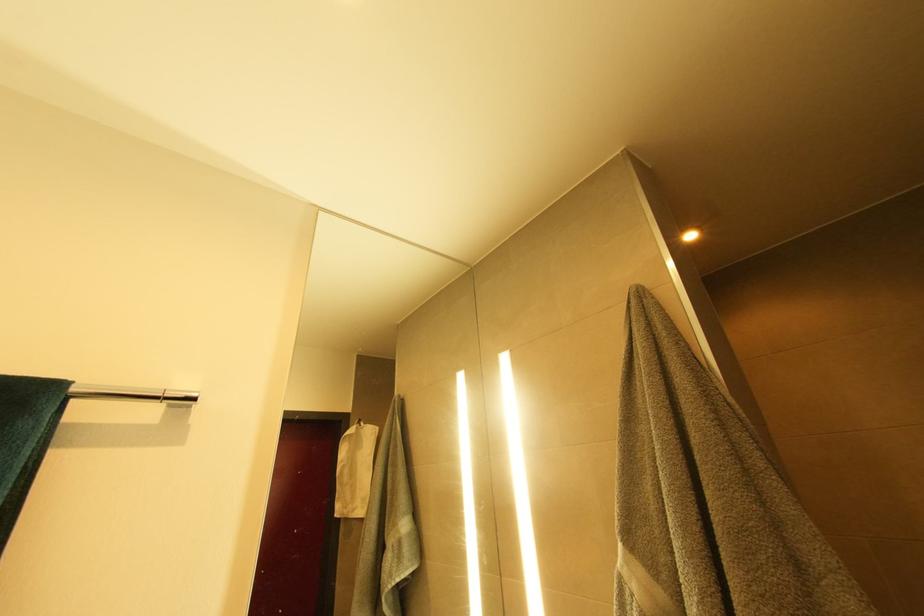
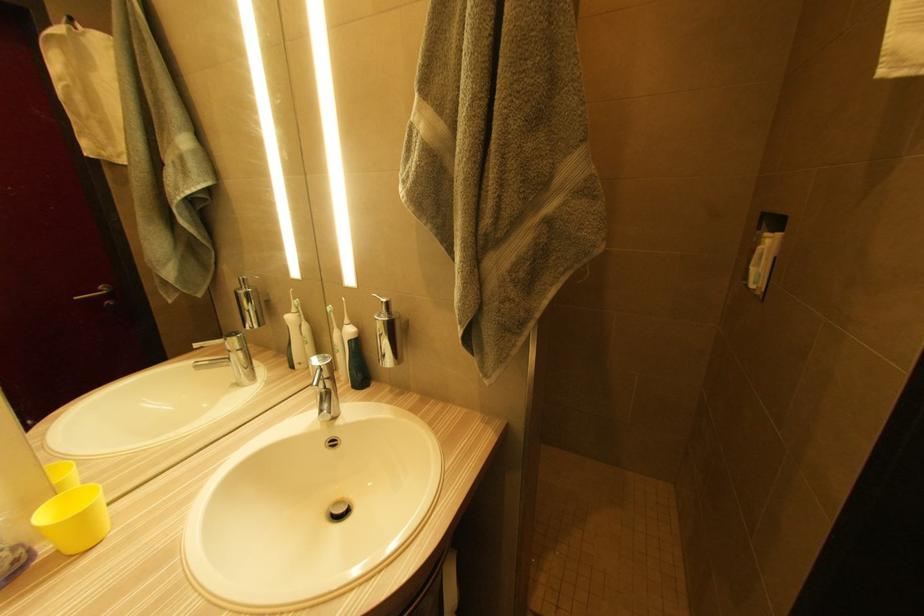
From the picture: Based on the continuous images, in which direction is the camera rotating?

The camera rotated toward right-down.